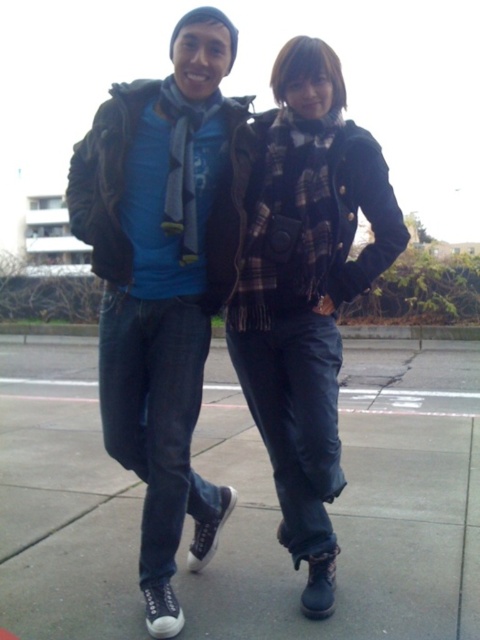
You are a photographer setting up a tripod to capture the scene. You notice the matte black jacket at center and the black rubber shoes at lower center. Which object should you focus on first if you want to capture the one that is positioned to the left?

The matte black jacket at center is to the left of the black rubber shoes at lower center, so you should focus on the matte black jacket at center first.

You are a fashion designer observing the two people in the image. You need to determine which item, the matte black jacket at center or the black rubber shoes at lower center, is positioned higher relative to the ground. Which one is higher?

The matte black jacket at center is positioned higher than the black rubber shoes at lower center because it is described as being above it.

You are designing a display case for a new fashion collection. The display case has a height limit of 1 meter. You need to place both the matte black jacket at center and the black rubber shoes at lower center inside. Can both items fit vertically in the display case if they are placed one above the other?

The matte black jacket at center is bigger than the black rubber shoes at lower center. However, the combined height of both items when stacked vertically may exceed the 1 meter limit. To determine if they fit, you would need to know the exact heights of each item individually. Since the description only states the jacket is bigger, but not by how much, we cannot confirm if the total height stays within the limit.